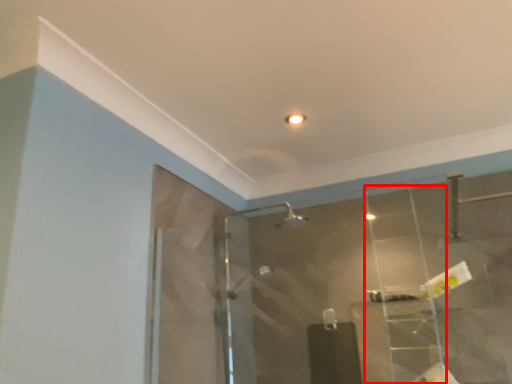
Question: Considering the relative positions of ladder (annotated by the red box) and mirror in the image provided, where is ladder (annotated by the red box) located with respect to the staircase?

Choices:
 (A) right
 (B) left

Answer: (A)